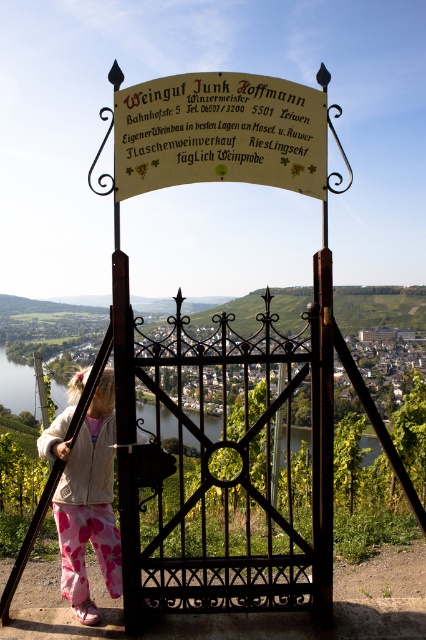
Question: Which is farther from the wooden sign at center?

Choices:
 (A) fluffy pink pants at lower left
 (B) black wrought iron gate at center

Answer: (B)

Question: Can you confirm if wooden sign at center is smaller than fluffy pink pants at lower left?

Choices:
 (A) no
 (B) yes

Answer: (B)

Question: Can you confirm if wooden sign at center is positioned to the left of fluffy pink pants at lower left?

Choices:
 (A) no
 (B) yes

Answer: (A)

Question: Does wooden sign at center appear over fluffy pink pants at lower left?

Choices:
 (A) yes
 (B) no

Answer: (A)

Question: Which point appears farthest from the camera in this image?

Choices:
 (A) (92, 506)
 (B) (149, 113)

Answer: (A)

Question: Which of the following is the closest to the observer?

Choices:
 (A) wooden sign at center
 (B) fluffy pink pants at lower left

Answer: (A)